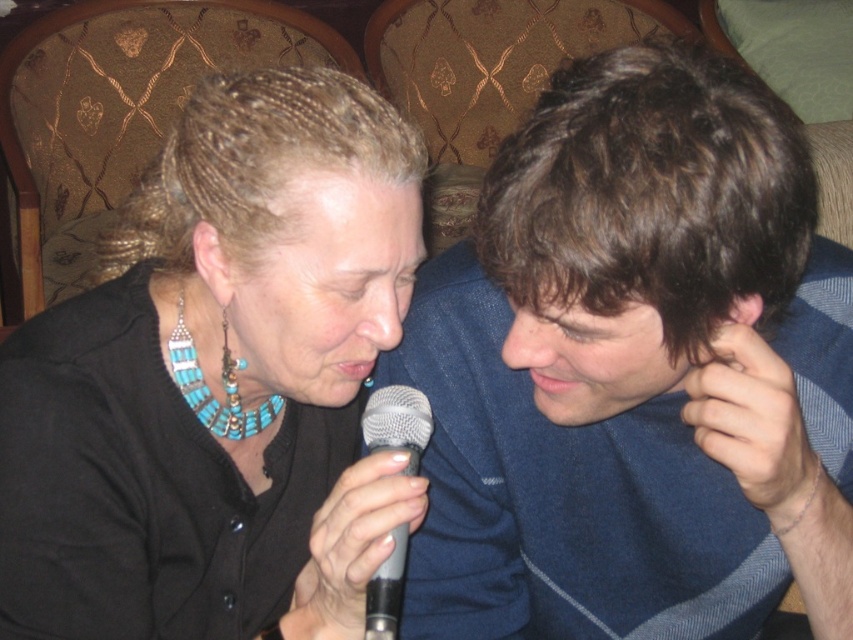
You are standing at the camera position and want to reach the point marked as point (694, 93). If your arm is 60 centimeters long, can you reach it without moving your feet?

The distance between the point (694, 93) and the camera is 55.00 centimeters, so yes, you can reach it with your arm since it is shorter than your arm length of 60 centimeters.

You are a photographer trying to capture a closeup of the person on the left. You are standing at the camera position. Which of the two points, point (704, 160) or point (398, 417), is closer to your camera lens?

Point (704, 160) is closer to the camera than point (398, 417).